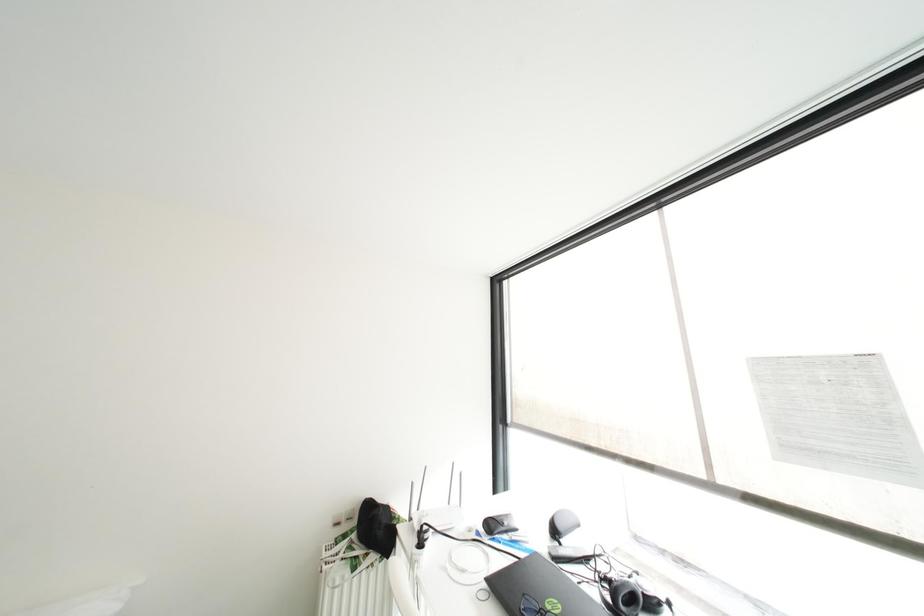
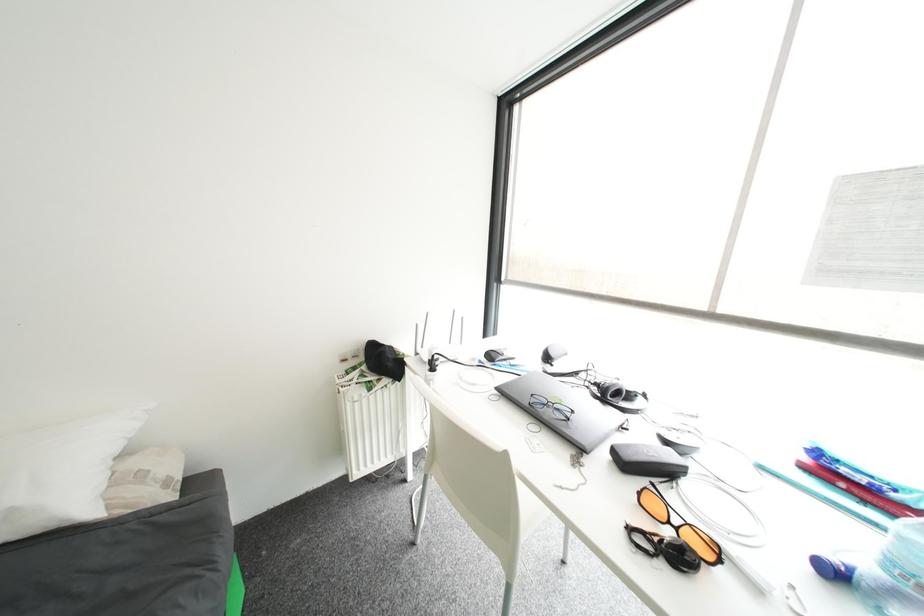
In a continuous first-person perspective shot, in which direction is the camera moving?

The cameraman walked toward left, forward.